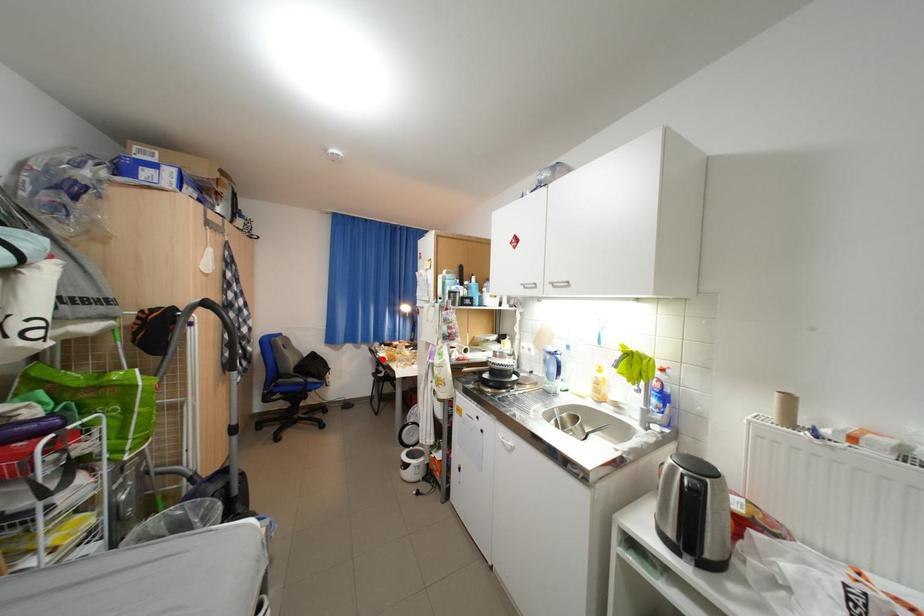
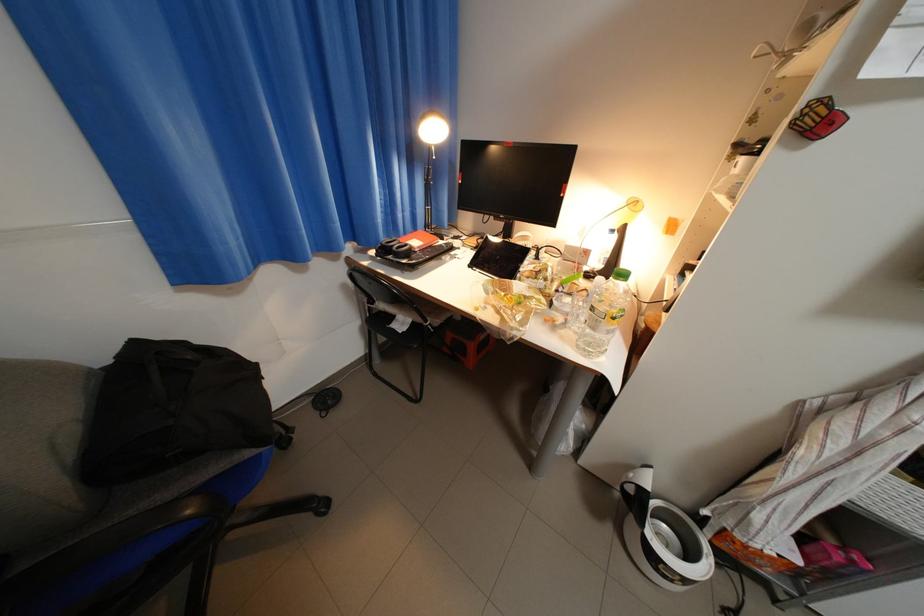
Find the pixel in the second image that matches the highlighted location in the first image.

(355, 286)